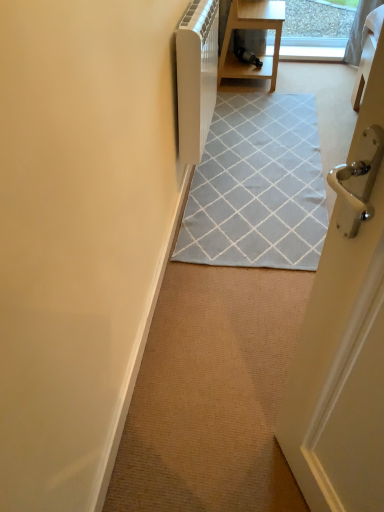
Identify the location of light gray woven rug at center. (257, 187).

The image size is (384, 512). I want to click on wooden table at upper center, so click(252, 28).

Locate an element on the screen. The image size is (384, 512). white matte door at left is located at coordinates (88, 222).

What do you see at coordinates (212, 394) in the screenshot? The image size is (384, 512). I see `carpet at center` at bounding box center [212, 394].

At what (x,y) coordinates should I click in order to perform the action: click on light gray woven rug at center. Please return your answer as a coordinate pair (x, y). The height and width of the screenshot is (512, 384). Looking at the image, I should click on (257, 187).

Between white matte door at left and wooden table at upper center, which one has smaller width?

white matte door at left is thinner.

Is wooden table at upper center at the back of white matte door at left?

No, white matte door at left is not facing the opposite direction of wooden table at upper center.

Between white matte door at left and wooden table at upper center, which one is positioned behind?

wooden table at upper center.

From the image's perspective, between white matte door at left and wooden table at upper center, which one is located above?

wooden table at upper center appears higher in the image.

Is white matte door at left taller than white plastic radiator at upper center?

No, white matte door at left is not taller than white plastic radiator at upper center.

Is white matte door at left thinner than white plastic radiator at upper center?

Indeed, white matte door at left has a lesser width compared to white plastic radiator at upper center.

Is white matte door at left to the left of white plastic radiator at upper center from the viewer's perspective?

Yes.

Considering the relative sizes of white matte door at left and white plastic radiator at upper center in the image provided, is white matte door at left bigger than white plastic radiator at upper center?

No, white matte door at left is not bigger than white plastic radiator at upper center.

Based on the photo, can you confirm if light gray woven rug at center is positioned to the left of white plastic radiator at upper center?

No, light gray woven rug at center is not to the left of white plastic radiator at upper center.

Is light gray woven rug at center not within white plastic radiator at upper center?

Indeed, light gray woven rug at center is completely outside white plastic radiator at upper center.

Can you confirm if light gray woven rug at center is wider than white plastic radiator at upper center?

Yes.

Based on the photo, based on their positions, is carpet at center located to the left or right of wooden table at upper center?

carpet at center is to the right of wooden table at upper center.

From a real-world perspective, is carpet at center physically below wooden table at upper center?

Correct, in the physical world, carpet at center is lower than wooden table at upper center.

Is carpet at center further to camera compared to wooden table at upper center?

No, it is in front of wooden table at upper center.

Is wooden table at upper center located within carpet at center?

No, wooden table at upper center is not a part of carpet at center.

Is wooden table at upper center outside of light gray woven rug at center?

wooden table at upper center is positioned outside light gray woven rug at center.

The height and width of the screenshot is (512, 384). Identify the location of table behind the light gray woven rug at center. (252, 28).

From a real-world perspective, is wooden table at upper center over light gray woven rug at center?

Yes, from a real-world perspective, wooden table at upper center is over light gray woven rug at center

Based on their sizes in the image, would you say wooden table at upper center is bigger or smaller than light gray woven rug at center?

wooden table at upper center is bigger than light gray woven rug at center.

From a real-world perspective, is white plastic radiator at upper center positioned under light gray woven rug at center based on gravity?

Incorrect, from a real-world perspective, white plastic radiator at upper center is higher than light gray woven rug at center.

Consider the image. Does white plastic radiator at upper center turn towards light gray woven rug at center?

No, white plastic radiator at upper center does not turn towards light gray woven rug at center.

What's the angular difference between white plastic radiator at upper center and light gray woven rug at center's facing directions?

The angular difference between white plastic radiator at upper center and light gray woven rug at center is 2.07 degrees.

Which of these two, white plastic radiator at upper center or light gray woven rug at center, is smaller?

light gray woven rug at center is smaller.

Is carpet at center positioned with its back to white matte door at left?

That's not correct — carpet at center is not looking away from white matte door at left.

Between carpet at center and white matte door at left, which one has larger width?

carpet at center.

Considering the relative sizes of carpet at center and white matte door at left in the image provided, is carpet at center shorter than white matte door at left?

Yes, carpet at center is shorter than white matte door at left.

At what (x,y) coordinates should I click in order to perform the action: click on table that is above the white matte door at left (from a real-world perspective). Please return your answer as a coordinate pair (x, y). The height and width of the screenshot is (512, 384). Looking at the image, I should click on (252, 28).

Image resolution: width=384 pixels, height=512 pixels. Find the location of `appliance above the white matte door at left (from the image's perspective)`. appliance above the white matte door at left (from the image's perspective) is located at coordinates (196, 78).

Estimate the real-world distances between objects in this image. Which object is closer to white plastic radiator at upper center, wooden table at upper center or carpet at center?

carpet at center is positioned closer to the anchor white plastic radiator at upper center.

Estimate the real-world distances between objects in this image. Which object is closer to white matte door at left, white plastic radiator at upper center or light gray woven rug at center?

white plastic radiator at upper center.

Estimate the real-world distances between objects in this image. Which object is closer to carpet at center, wooden table at upper center or light gray woven rug at center?

light gray woven rug at center is closer to carpet at center.

From the picture: When comparing their distances from white plastic radiator at upper center, does light gray woven rug at center or carpet at center seem closer?

light gray woven rug at center lies closer to white plastic radiator at upper center than the other object.

Considering their positions, is carpet at center positioned closer to wooden table at upper center than light gray woven rug at center?

Among the two, light gray woven rug at center is located nearer to wooden table at upper center.

Looking at the image, which one is located further to carpet at center, white matte door at left or light gray woven rug at center?

light gray woven rug at center lies further to carpet at center than the other object.

From the image, which object appears to be nearer to carpet at center, white matte door at left or white plastic radiator at upper center?

white matte door at left lies closer to carpet at center than the other object.

Which object lies nearer to the anchor point light gray woven rug at center, white matte door at left or white plastic radiator at upper center?

white plastic radiator at upper center.

Find the location of a particular element. doormat located between white matte door at left and wooden table at upper center in the depth direction is located at coordinates (257, 187).

Where is `appliance between carpet at center and wooden table at upper center along the z-axis`? The image size is (384, 512). appliance between carpet at center and wooden table at upper center along the z-axis is located at coordinates (196, 78).

You are a GUI agent. You are given a task and a screenshot of the screen. Output one action in this format:
    pyautogui.click(x=<x>, y=<y>)
    Task: Click on the appliance positioned between white matte door at left and wooden table at upper center from near to far
    
    Given the screenshot: What is the action you would take?
    pyautogui.click(x=196, y=78)

Identify the location of appliance located between white matte door at left and carpet at center in the left-right direction. (196, 78).